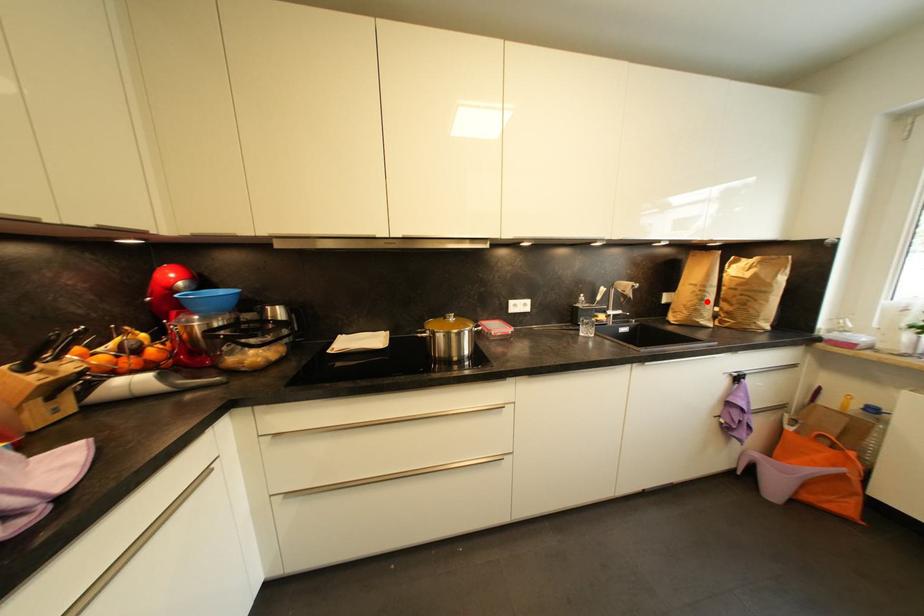
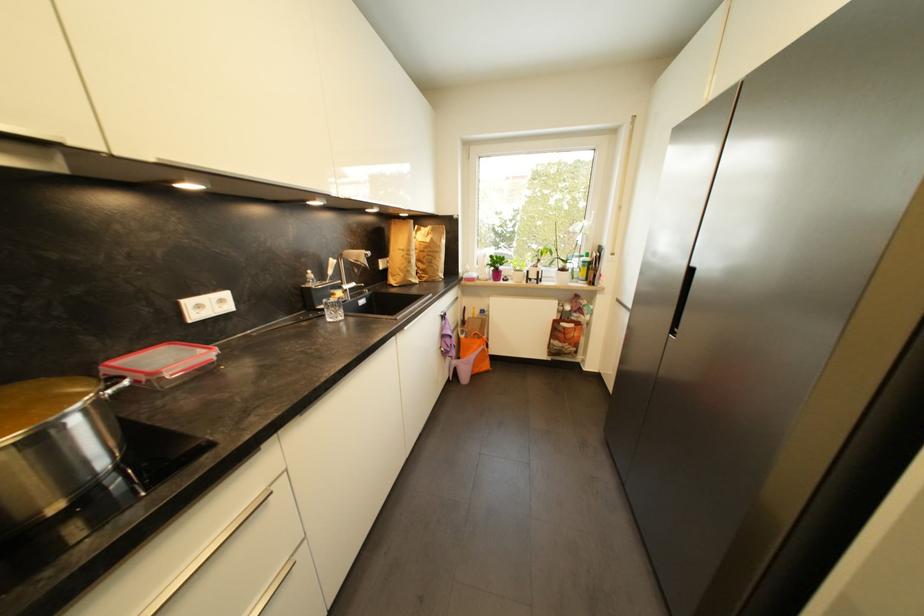
Find the pixel in the second image that matches the highlighted location in the first image.

(415, 264)